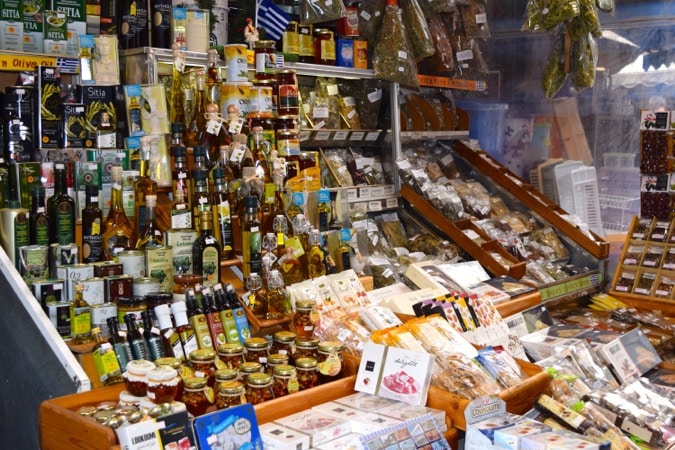
At what (x,y) coordinates should I click in order to perform the action: click on light. Please return your answer as a coordinate pair (x, y). This screenshot has width=675, height=450. Looking at the image, I should click on (638, 67).